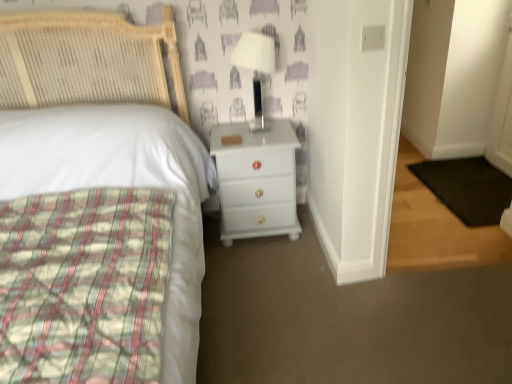
Question: Is white woven headboard at upper left in front of or behind white glossy chest of drawers at center in the image?

Choices:
 (A) front
 (B) behind

Answer: (A)

Question: Is white woven headboard at upper left bigger or smaller than white glossy chest of drawers at center?

Choices:
 (A) small
 (B) big

Answer: (B)

Question: Which object is the farthest from the white glossy lamp at upper right?

Choices:
 (A) white glossy chest of drawers at center
 (B) white woven headboard at upper left

Answer: (B)

Question: Which of these objects is positioned farthest from the white woven headboard at upper left?

Choices:
 (A) white glossy chest of drawers at center
 (B) white glossy lamp at upper right

Answer: (B)